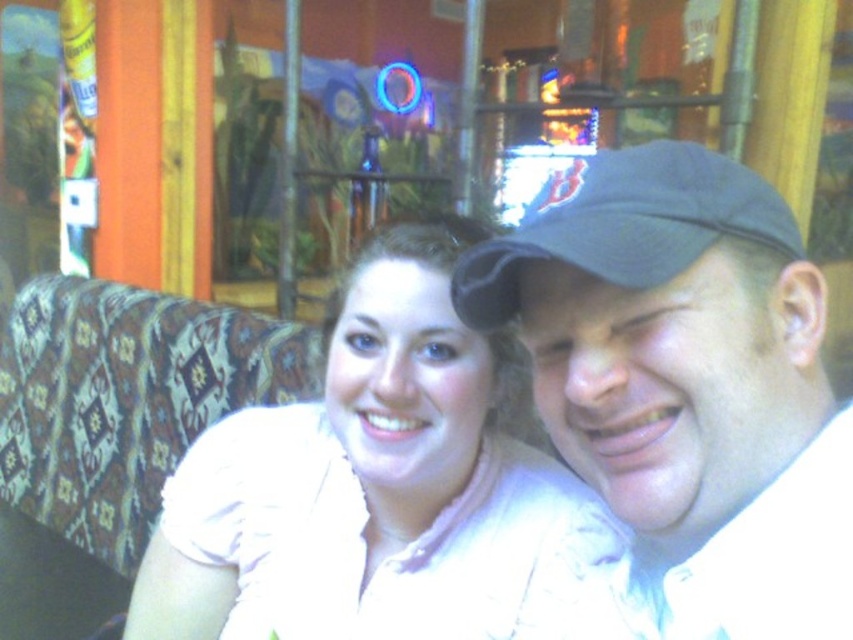
Does black fabric cap at upper right lie in front of dark blue fabric baseball cap at upper right?

Yes, black fabric cap at upper right is closer to the viewer.

Between black fabric cap at upper right and dark blue fabric baseball cap at upper right, which one has more height?

black fabric cap at upper right is taller.

Is point (695, 157) more distant than point (668, 257)?

Yes, point (695, 157) is behind point (668, 257).

The width and height of the screenshot is (853, 640). I want to click on black fabric cap at upper right, so click(685, 387).

Is white matte shirt at center to the left of dark blue fabric baseball cap at upper right from the viewer's perspective?

Correct, you'll find white matte shirt at center to the left of dark blue fabric baseball cap at upper right.

Is point (152, 541) less distant than point (656, 285)?

No, (152, 541) is behind (656, 285).

Locate an element on the screen. This screenshot has height=640, width=853. white matte shirt at center is located at coordinates (375, 486).

Does black fabric cap at upper right have a larger size compared to white matte shirt at center?

Actually, black fabric cap at upper right might be smaller than white matte shirt at center.

Does black fabric cap at upper right appear under white matte shirt at center?

Incorrect, black fabric cap at upper right is not positioned below white matte shirt at center.

Is point (619, 444) behind point (405, 444)?

No, (619, 444) is in front of (405, 444).

Where is `black fabric cap at upper right`? black fabric cap at upper right is located at coordinates (685, 387).